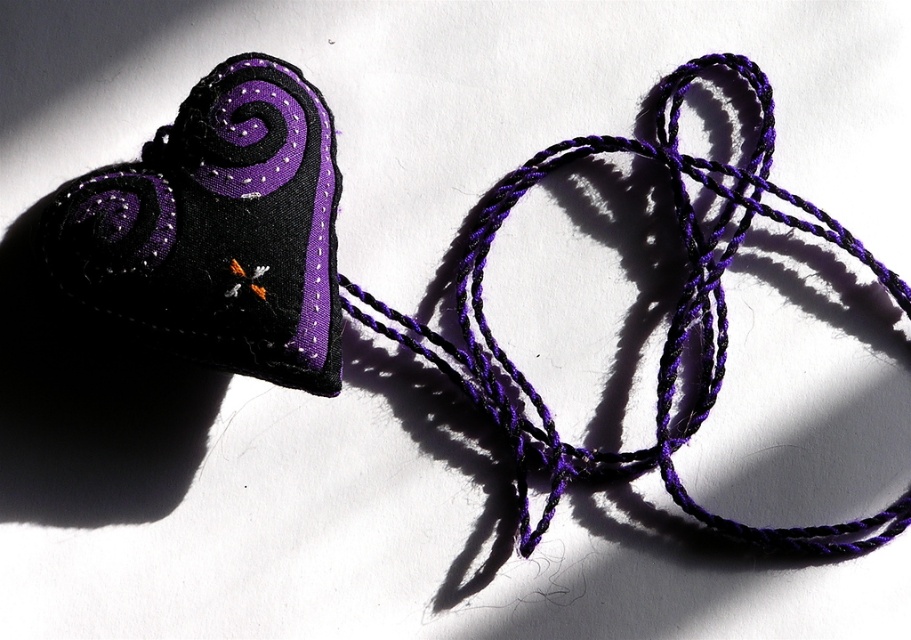
Who is more forward, (x=135, y=266) or (x=627, y=141)?

Point (x=135, y=266) is in front.

From the picture: Which is more to the left, matte black fabric heart at upper left or purple twisted string at center?

matte black fabric heart at upper left

Image resolution: width=911 pixels, height=640 pixels. Find the location of `matte black fabric heart at upper left`. matte black fabric heart at upper left is located at coordinates (218, 230).